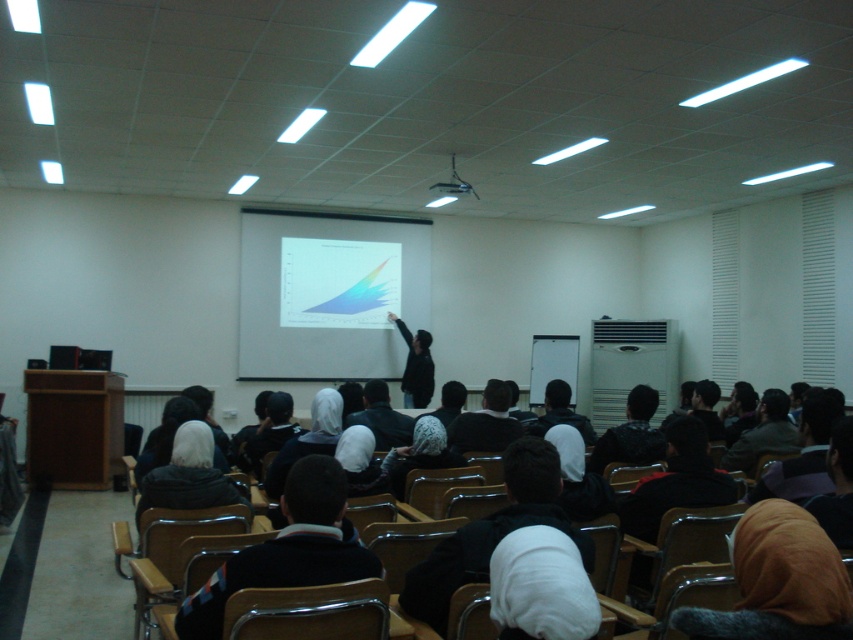
Question: Does black fabric jacket at center lie in front of white matte jacket at lower left?

Choices:
 (A) no
 (B) yes

Answer: (B)

Question: From the image, what is the correct spatial relationship of black fabric jacket at center in relation to black plastic projector at upper center?

Choices:
 (A) below
 (B) above

Answer: (A)

Question: Among these objects, which one is farthest from the camera?

Choices:
 (A) black fabric headscarf at center
 (B) white matte jacket at lower left
 (C) black plastic projector at upper center

Answer: (C)

Question: Can you confirm if black fabric headscarf at center is smaller than dark brown leather jacket at center?

Choices:
 (A) no
 (B) yes

Answer: (B)

Question: Which object appears closest to the camera in this image?

Choices:
 (A) black fabric headscarf at center
 (B) white soft sweater at center
 (C) black fabric jacket at center
 (D) black plastic projector at upper center

Answer: (B)

Question: Which point is farther from the camera taking this photo?

Choices:
 (A) (579, 416)
 (B) (447, 444)
 (C) (308, 502)
 (D) (585, 552)

Answer: (A)